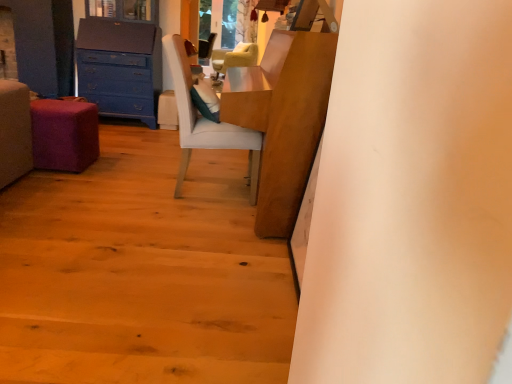
Question: Is white fabric chair at center, the first chair in the front-to-back sequence, turned away from wooden table at center?

Choices:
 (A) yes
 (B) no

Answer: (A)

Question: Does white fabric chair at center, which ranks as the 2th chair in top-to-bottom order, have a larger size compared to wooden table at center?

Choices:
 (A) yes
 (B) no

Answer: (B)

Question: From a real-world perspective, is white fabric chair at center, which ranks as the 2th chair in top-to-bottom order, physically below wooden table at center?

Choices:
 (A) yes
 (B) no

Answer: (A)

Question: Is white fabric chair at center, the first chair in the front-to-back sequence, at the left side of wooden table at center?

Choices:
 (A) no
 (B) yes

Answer: (B)

Question: Does white fabric chair at center, which is the 1th chair from bottom to top, appear on the right side of wooden table at center?

Choices:
 (A) no
 (B) yes

Answer: (A)

Question: Is white fabric chair at center, the first chair in the front-to-back sequence, not close to wooden table at center?

Choices:
 (A) yes
 (B) no

Answer: (B)

Question: Is wooden floor at lower left facing away from velvet beige armchair at center, the 1th chair viewed from the top?

Choices:
 (A) yes
 (B) no

Answer: (B)

Question: Is wooden floor at lower left further to camera compared to velvet beige armchair at center, which is the second chair from bottom to top?

Choices:
 (A) no
 (B) yes

Answer: (A)

Question: Is wooden floor at lower left taller than velvet beige armchair at center, the 1th chair viewed from the top?

Choices:
 (A) no
 (B) yes

Answer: (A)

Question: Is wooden floor at lower left to the left of velvet beige armchair at center, the 1th chair viewed from the top, from the viewer's perspective?

Choices:
 (A) yes
 (B) no

Answer: (A)

Question: Is velvet beige armchair at center, which is the second chair from bottom to top, a part of wooden floor at lower left?

Choices:
 (A) yes
 (B) no

Answer: (B)

Question: From the image's perspective, is wooden floor at lower left below velvet beige armchair at center, which is the second chair from bottom to top?

Choices:
 (A) yes
 (B) no

Answer: (A)

Question: From the image's perspective, does purple fabric stool at lower left appear lower than blue painted wood chest of drawers at left?

Choices:
 (A) no
 (B) yes

Answer: (B)